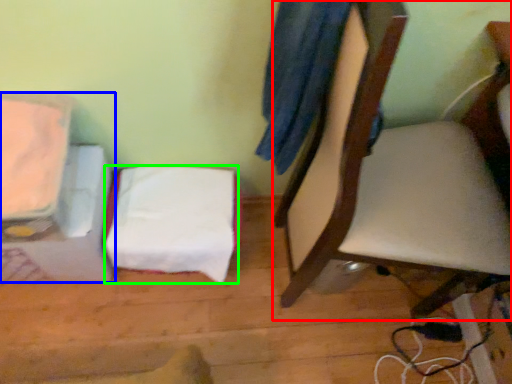
Question: Considering the real-world distances, which object is closest to chair (highlighted by a red box)? furniture (highlighted by a blue box) or sheet (highlighted by a green box).

Choices:
 (A) furniture
 (B) sheet

Answer: (B)